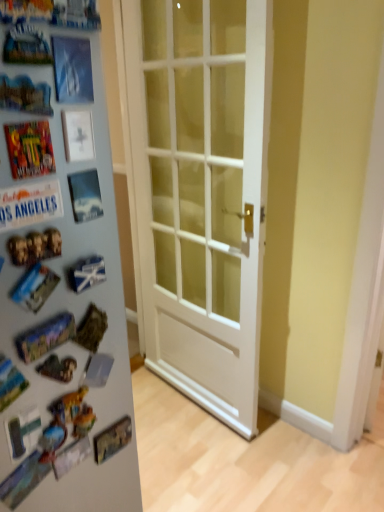
Locate an element on the screen. This screenshot has height=512, width=384. free location to the left of white glossy door at center is located at coordinates click(170, 459).